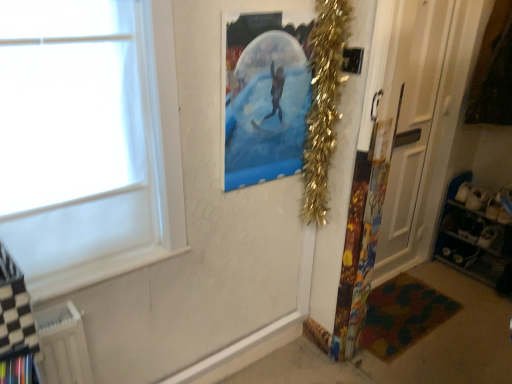
You are a GUI agent. You are given a task and a screenshot of the screen. Output one action in this format:
    pyautogui.click(x=<x>, y=<y>)
    Task: Click on the vacant area situated below multicolored fabric mat at lower right (from a real-world perspective)
    
    Given the screenshot: What is the action you would take?
    pyautogui.click(x=398, y=306)